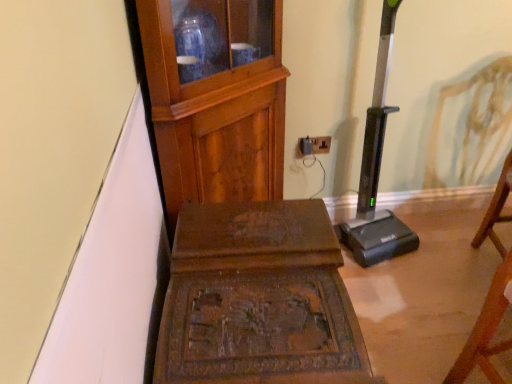
Question: Relative to wooden cabinet at upper left, which is counted as the third furniture, starting from the right, is carved wood table at center, the second furniture in the right-to-left sequence, in front or behind?

Choices:
 (A) front
 (B) behind

Answer: (A)

Question: Is point (207, 322) closer or farther from the camera than point (251, 97)?

Choices:
 (A) farther
 (B) closer

Answer: (B)

Question: Which object is the farthest from the carved wood table at center, marked as the second furniture in a left-to-right arrangement?

Choices:
 (A) black plastic outlet at center
 (B) wooden chair at right, arranged as the third furniture when viewed from the left
 (C) wooden cabinet at upper left, the 1th furniture viewed from the left

Answer: (A)

Question: Which object is positioned closest to the black plastic outlet at center?

Choices:
 (A) wooden cabinet at upper left, the 1th furniture viewed from the left
 (B) carved wood table at center, the second furniture in the right-to-left sequence
 (C) wooden chair at right, which appears as the first furniture when viewed from the right

Answer: (A)